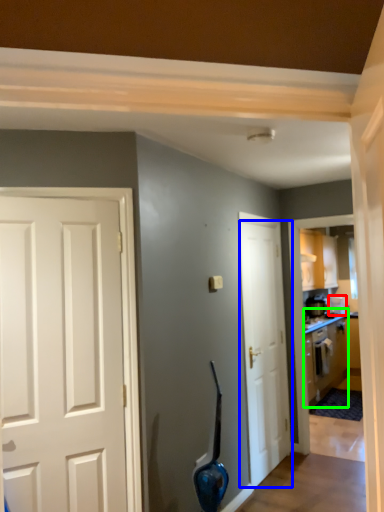
Question: Based on their relative distances, which object is nearer to appliance (highlighted by a red box)? Choose from door (highlighted by a blue box) and cabinetry (highlighted by a green box).

Choices:
 (A) door
 (B) cabinetry

Answer: (B)